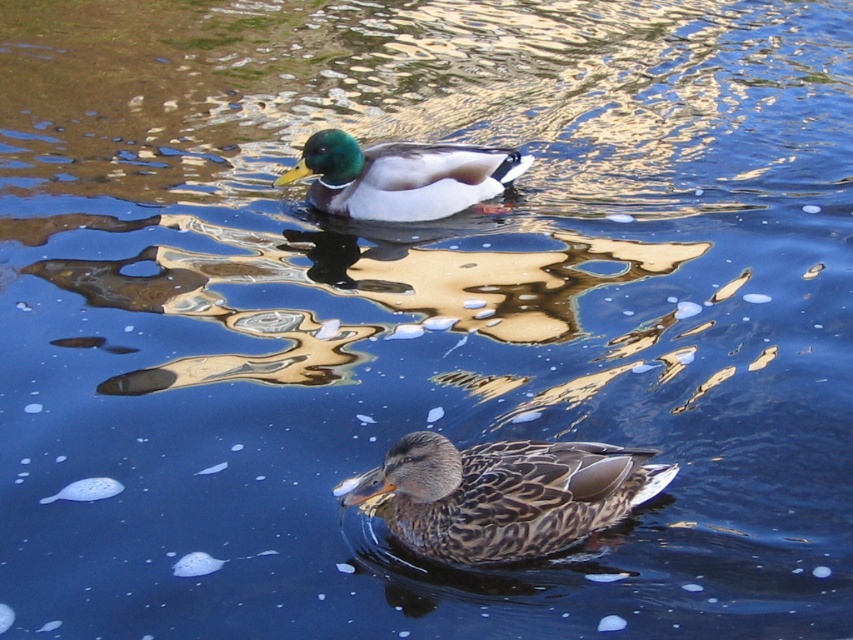
Question: Which point is farther from the camera taking this photo?

Choices:
 (A) (315, 193)
 (B) (659, 483)

Answer: (A)

Question: Is brown speckled feathers at center further to camera compared to shiny brown duck at upper center?

Choices:
 (A) yes
 (B) no

Answer: (B)

Question: Is brown speckled feathers at center wider than shiny brown duck at upper center?

Choices:
 (A) yes
 (B) no

Answer: (B)

Question: Which point is closer to the camera taking this photo?

Choices:
 (A) (492, 168)
 (B) (585, 538)

Answer: (B)

Question: In this image, where is brown speckled feathers at center located relative to shiny brown duck at upper center?

Choices:
 (A) left
 (B) right

Answer: (B)